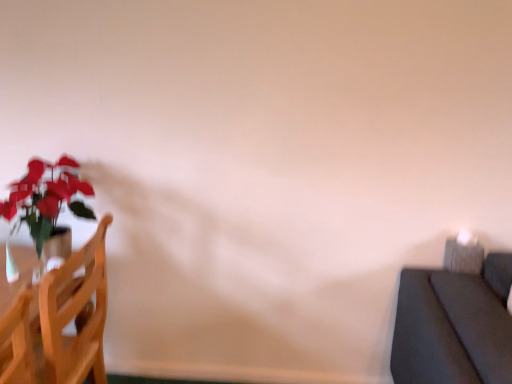
The image size is (512, 384). Identify the location of wooden chair at left. (58, 322).

What do you see at coordinates (58, 322) in the screenshot? I see `wooden chair at left` at bounding box center [58, 322].

At what (x,y) coordinates should I click in order to perform the action: click on wooden chair at left. Please return your answer as a coordinate pair (x, y). This screenshot has height=384, width=512. Looking at the image, I should click on (58, 322).